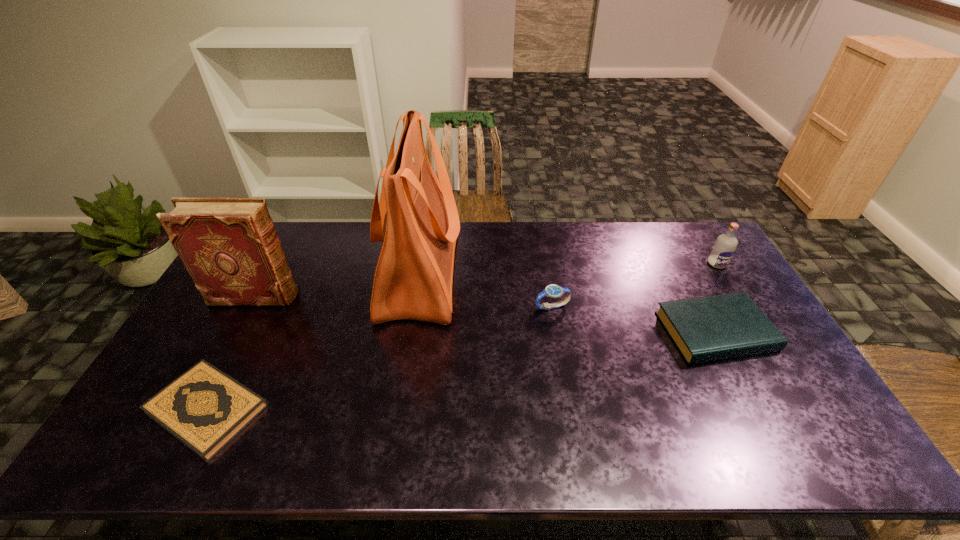
Image resolution: width=960 pixels, height=540 pixels. I want to click on the tallest object, so click(416, 218).

Identify the location of shopping bag. (416, 218).

This screenshot has height=540, width=960. I want to click on the fifth shortest object, so pos(229,246).

The image size is (960, 540). Identify the location of the fourth shortest object. (724, 247).

Where is `the third shortest object`? This screenshot has height=540, width=960. the third shortest object is located at coordinates (553, 291).

I want to click on the fourth object from left to right, so click(553, 291).

The image size is (960, 540). In order to click on the second shortest object in this screenshot , I will do `click(710, 328)`.

This screenshot has height=540, width=960. In order to click on the rightmost hardback book in this screenshot , I will do `click(710, 328)`.

At what (x,y) coordinates should I click in order to perform the action: click on the shortest hardback book. Please return your answer as a coordinate pair (x, y). This screenshot has width=960, height=540. Looking at the image, I should click on (204, 408).

This screenshot has height=540, width=960. I want to click on free point located 0.180m on the front pocket of the tallest object, so click(x=515, y=273).